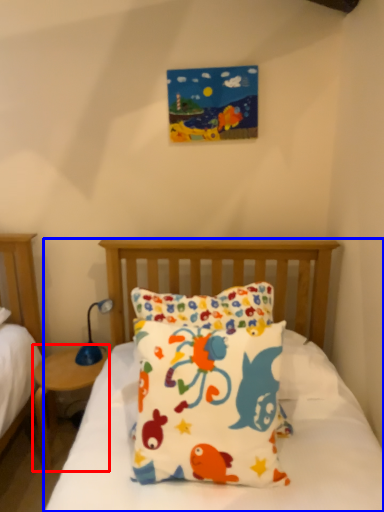
Question: Which of the following is the closest to the observer, nightstand (highlighted by a red box) or bed (highlighted by a blue box)?

Choices:
 (A) nightstand
 (B) bed

Answer: (B)